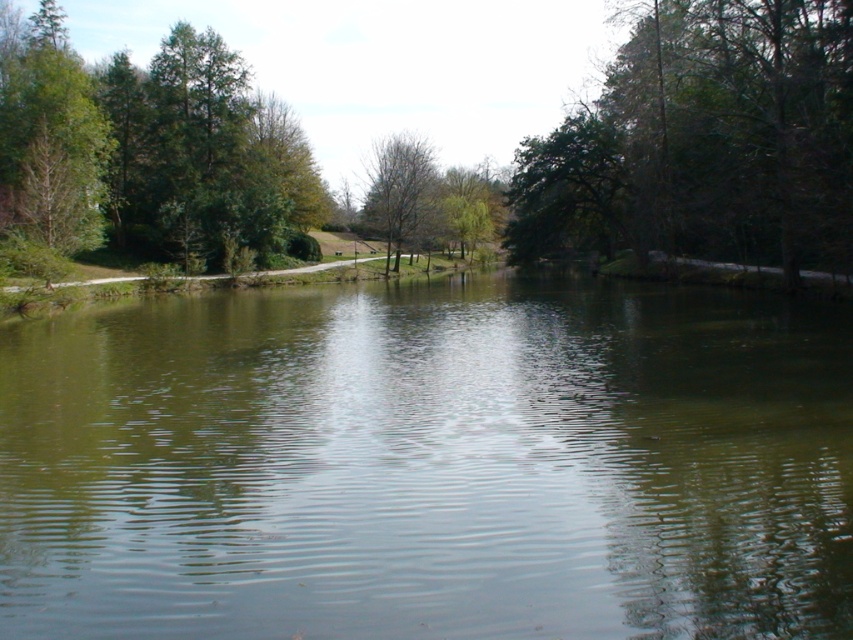
You are standing at the point with coordinates point [241,186] and want to walk to the point with coordinates point [572,624]. Which direction should you move to reach your destination?

You should move forward because point [572,624] is in front of point [241,186].